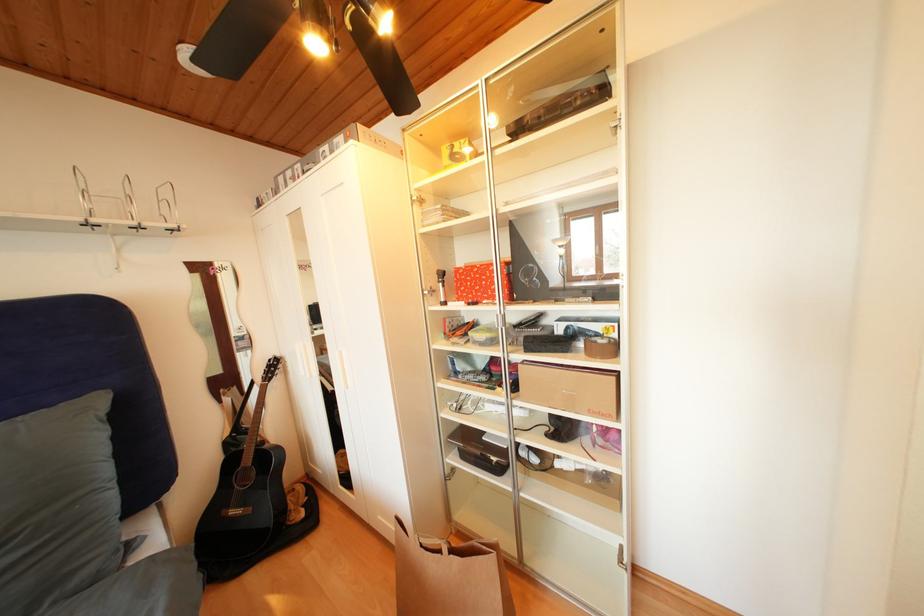
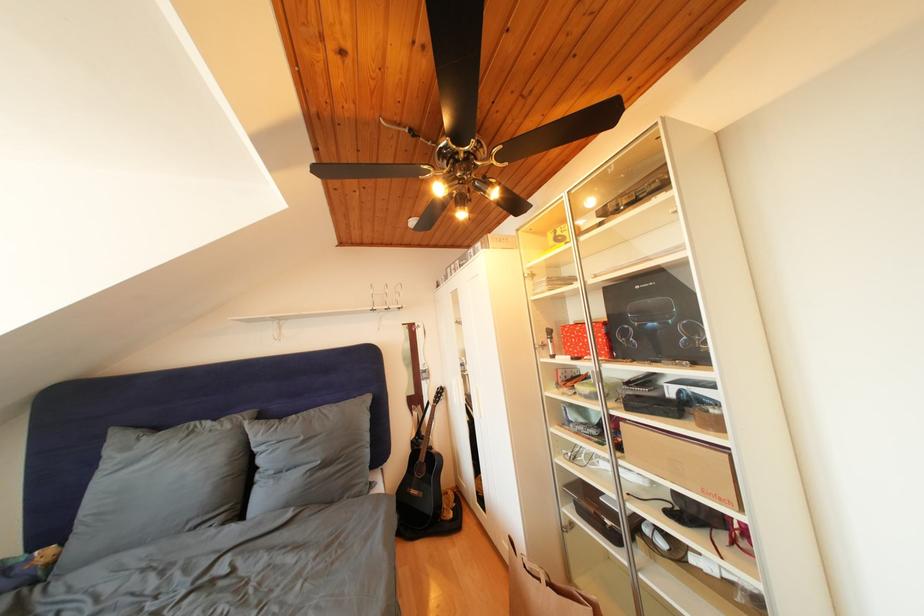
Find the pixel in the second image that matches point (441, 297) in the first image.

(552, 351)